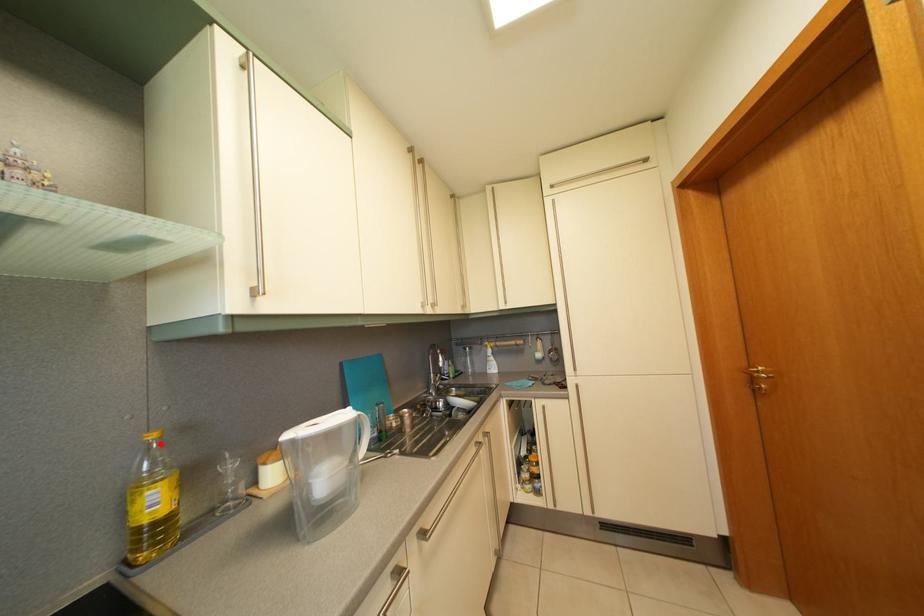
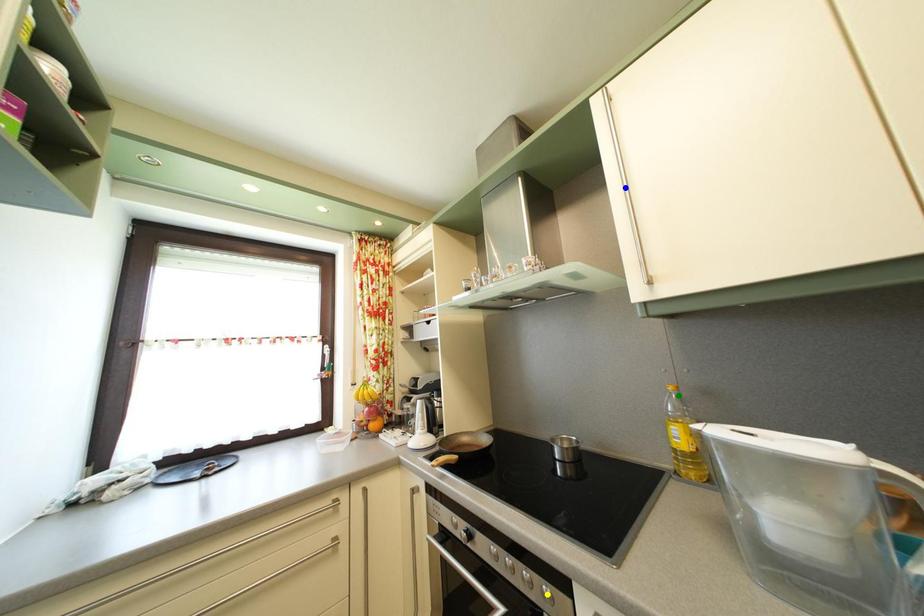
Question: I am providing you with two images of the same scene from different viewpoints. A red point is marked on the first image. You are given multiple points on the second image. Which point in image 2 is actually the same real-world point as the red point in image 1?

Choices:
 (A) yellow point
 (B) blue point
 (C) green point

Answer: (C)